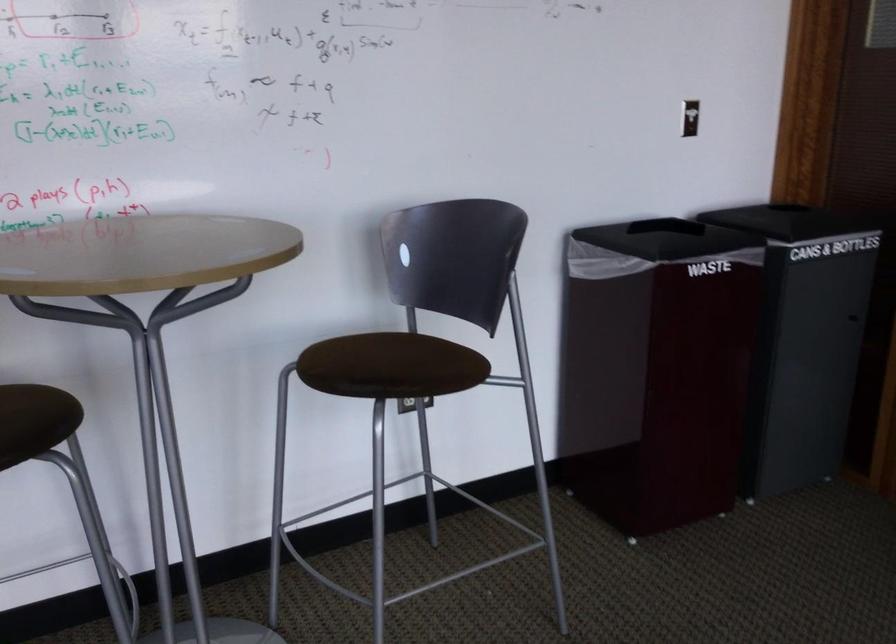
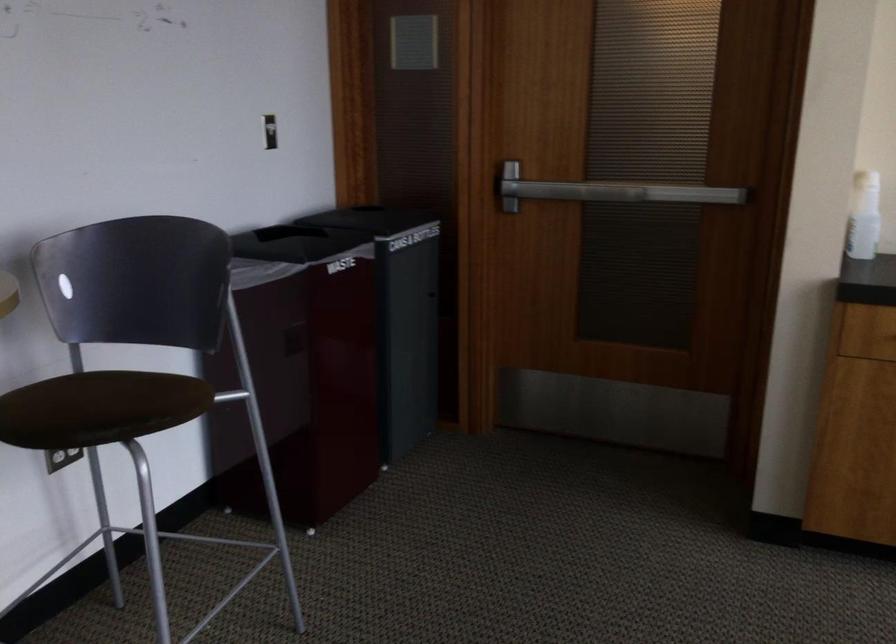
Question: Based on the continuous images, in which direction is the camera rotating? Reply with the corresponding letter.

Choices:
 (A) Left
 (B) Right
 (C) Up
 (D) Down

Answer: (B)